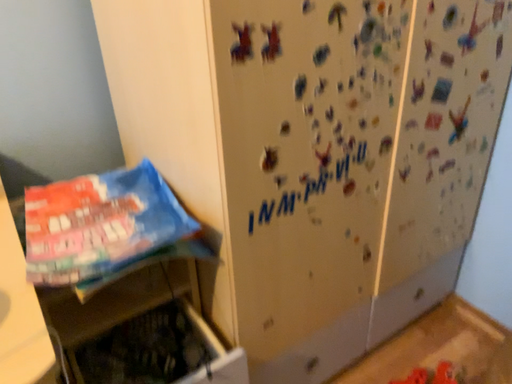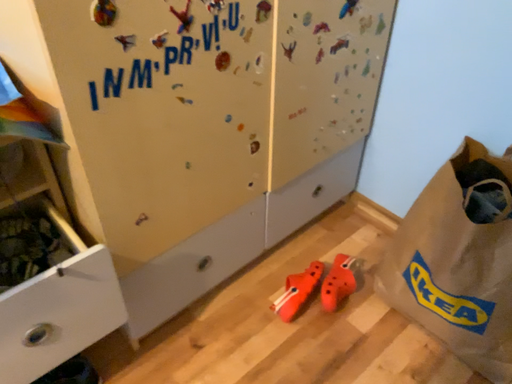
Question: Which way did the camera rotate in the video?

Choices:
 (A) rotated upward
 (B) rotated downward

Answer: (B)